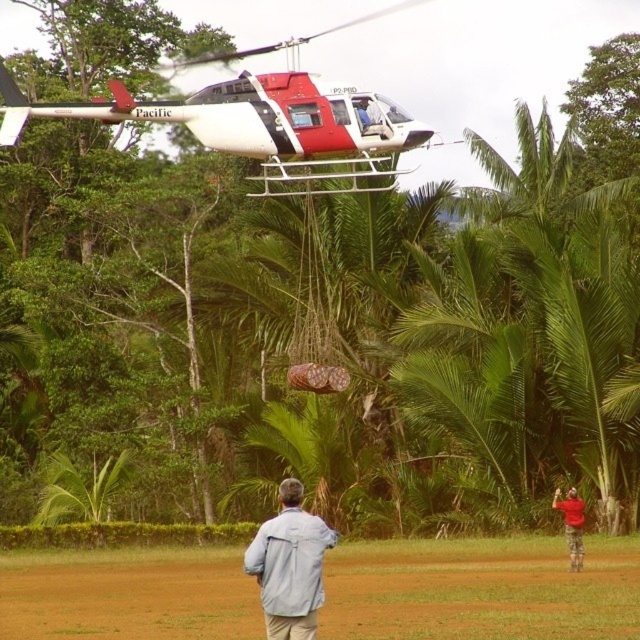
Question: Which of the following is the closest to the observer?

Choices:
 (A) (305, 547)
 (B) (520, 550)
 (C) (256, 140)

Answer: (A)

Question: Does red and white helicopter at upper center appear under red cotton shirt at lower right?

Choices:
 (A) no
 (B) yes

Answer: (A)

Question: Which object appears closest to the camera in this image?

Choices:
 (A) brown dirt field at lower center
 (B) red and white helicopter at upper center

Answer: (A)

Question: In this image, where is brown dirt field at lower center located relative to red and white helicopter at upper center?

Choices:
 (A) below
 (B) above

Answer: (A)

Question: In this image, where is brown dirt field at lower center located relative to red and white helicopter at upper center?

Choices:
 (A) below
 (B) above

Answer: (A)

Question: Which object appears closest to the camera in this image?

Choices:
 (A) red cotton shirt at lower right
 (B) brown dirt field at lower center
 (C) red and white helicopter at upper center
 (D) light blue denim jacket at lower center

Answer: (D)